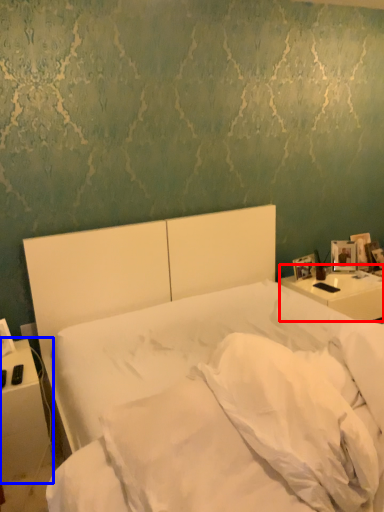
Question: Which object appears closest to the camera in this image, nightstand (highlighted by a red box) or nightstand (highlighted by a blue box)?

Choices:
 (A) nightstand
 (B) nightstand

Answer: (B)